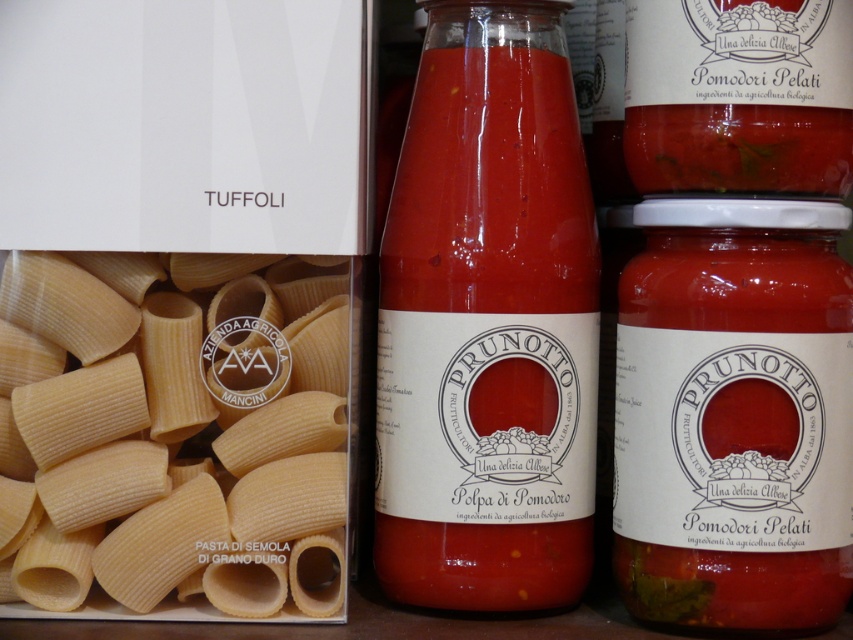
You are organizing a pantry and see the yellow semolina pasta at center and the translucent glass bottle at center on a shelf. Which item is closer to you?

The yellow semolina pasta at center is closer to you because it is in front of the translucent glass bottle at center.

You are organizing a pantry and need to place the yellow semolina pasta at center and the translucent glass bottle at center. According to the image, which item is positioned to the right of the other?

The yellow semolina pasta at center is to the left of the translucent glass bottle at center, so the translucent glass bottle at center is positioned to the right of the yellow semolina pasta at center.

You are organizing a pantry and need to place a new jar of pickles that is 8 inches in diameter. There is space between the yellow semolina pasta at center and the translucent glass bottle at center. Will the jar fit in that space?

The space between the yellow semolina pasta at center and the translucent glass bottle at center is 7.57 inches. Since the jar is 8 inches in diameter, it will not fit in that space as it is slightly wider than the available gap.